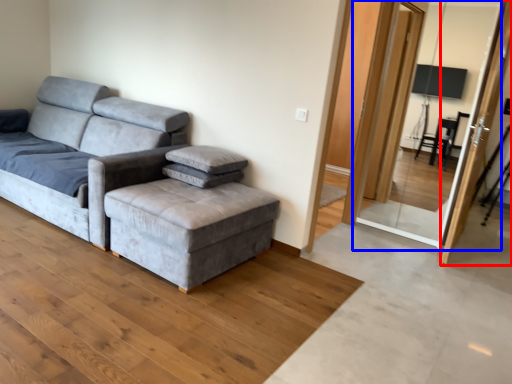
Question: Which point is further to the camera, screen door (highlighted by a red box) or screen door (highlighted by a blue box)?

Choices:
 (A) screen door
 (B) screen door

Answer: (B)